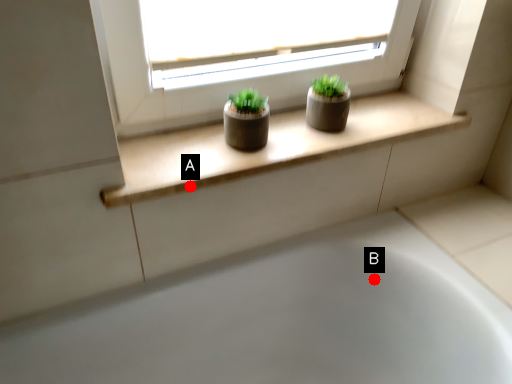
Question: Two points are circled on the image, labeled by A and B beside each circle. Which point is further to the camera?

Choices:
 (A) A is further
 (B) B is further

Answer: (B)